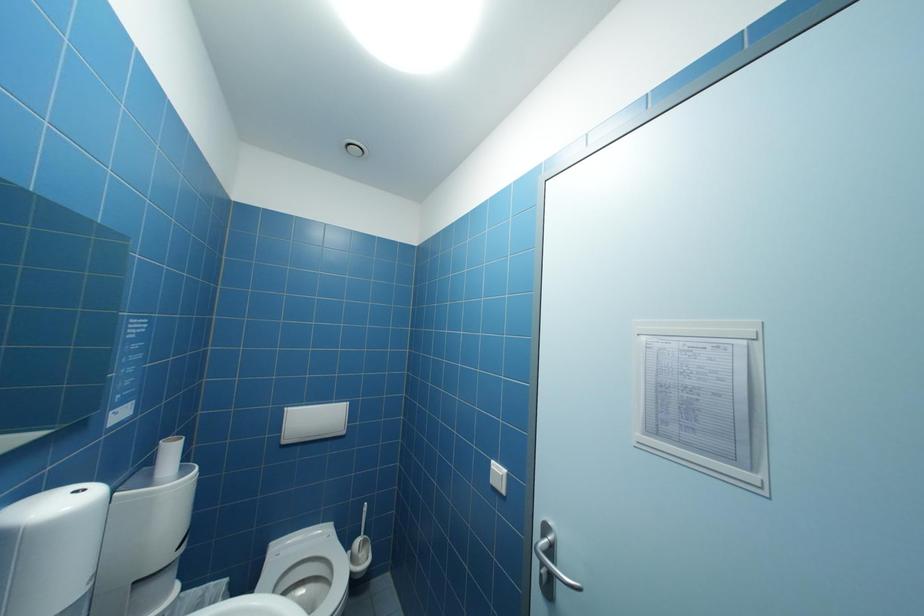
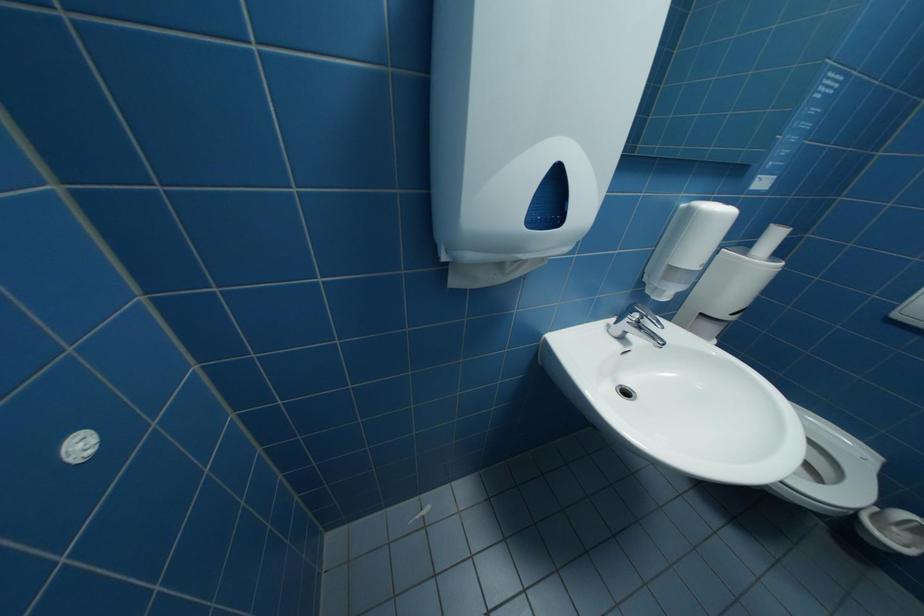
The first image is from the beginning of the video and the second image is from the end. How did the camera likely rotate when shooting the video?

The camera rotated toward left-down.